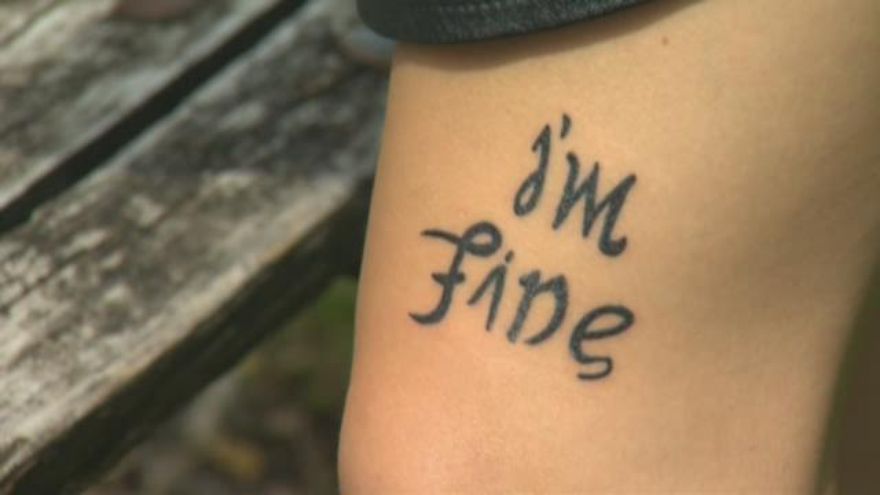
Where is `light grey wood`? The height and width of the screenshot is (495, 880). light grey wood is located at coordinates (28, 396).